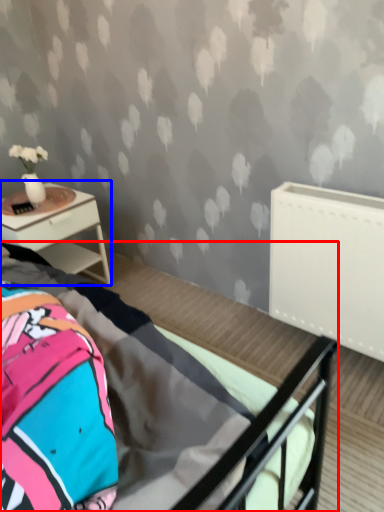
Question: Which of the following is the farthest to the observer, bed (highlighted by a red box) or nightstand (highlighted by a blue box)?

Choices:
 (A) bed
 (B) nightstand

Answer: (B)